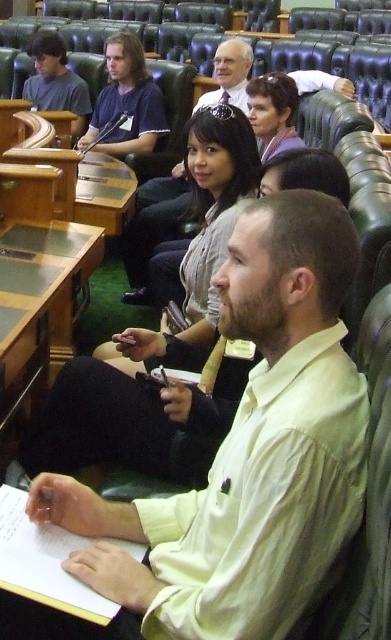
In the legislative chamber scene, there are two men wearing a matte black shirt at upper left and a light beige shirt at center. Which one is positioned further to the left?

The matte black shirt at upper left is positioned further to the left compared to the light beige shirt at center.

You are an event organizer who needs to arrange seating for two attendees wearing light yellow shirt at center and light beige shirt at center. Given their clothing dimensions, which attendee requires a wider seat?

The light yellow shirt at center requires a wider seat because its width is larger than the light beige shirt at center.

You are standing at the back of the chamber and want to take a photo of the two points in the image. Which point, point (84, 99) or point (240, 92), will appear closer to you in the photo?

Point (84, 99) is further to the camera than point (240, 92), so in the photo taken from the back of the chamber, point (84, 99) will appear closer to you.